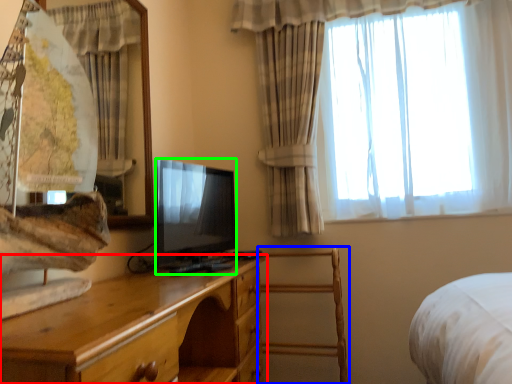
Question: Which object is positioned farthest from chest of drawers (highlighted by a red box)? Select from armchair (highlighted by a blue box) and television (highlighted by a green box).

Choices:
 (A) armchair
 (B) television

Answer: (A)